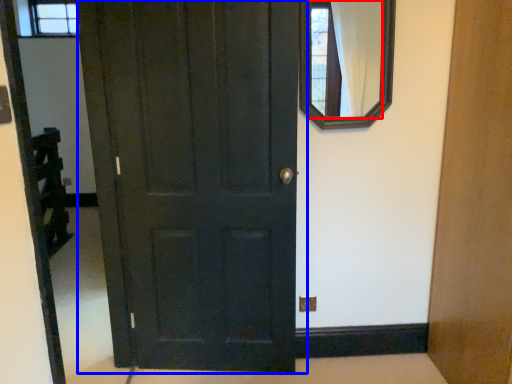
Question: Which of the following is the closest to the observer, mirror (highlighted by a red box) or door (highlighted by a blue box)?

Choices:
 (A) mirror
 (B) door

Answer: (B)